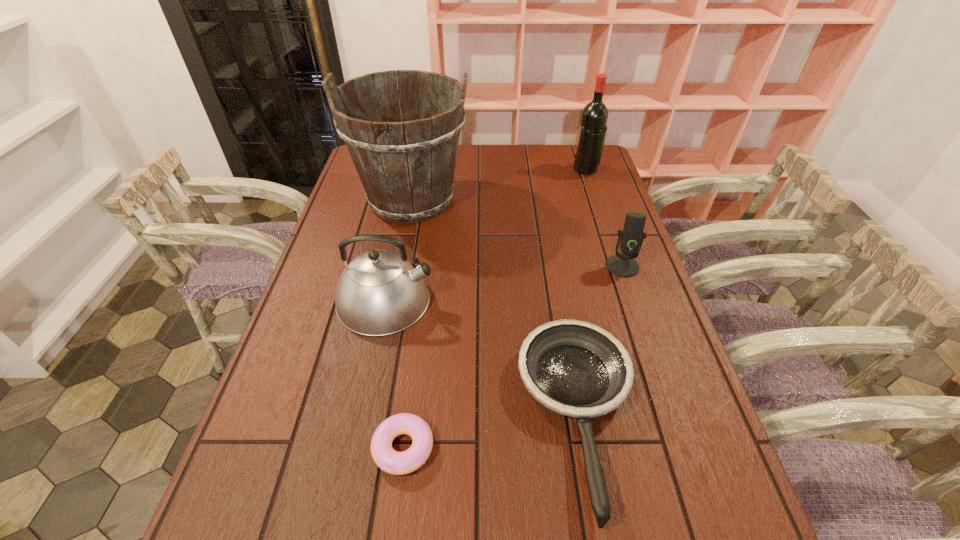
You are a GUI agent. You are given a task and a screenshot of the screen. Output one action in this format:
    pyautogui.click(x=<x>, y=<y>)
    Task: Click on the vacant region located 0.070m on the left of the microphone
    The height and width of the screenshot is (540, 960).
    Given the screenshot: What is the action you would take?
    coord(581,266)

The height and width of the screenshot is (540, 960). Find the location of `blank space located on the back of the shortest object`. blank space located on the back of the shortest object is located at coordinates (414, 366).

What are the coordinates of `bucket that is at the far edge` in the screenshot? It's located at (406, 166).

You are a GUI agent. You are given a task and a screenshot of the screen. Output one action in this format:
    pyautogui.click(x=<x>, y=<y>)
    Task: Click on the wine bottle that is at the far edge
    The width and height of the screenshot is (960, 540).
    Given the screenshot: What is the action you would take?
    pyautogui.click(x=594, y=116)

The height and width of the screenshot is (540, 960). Find the location of `bucket that is at the left edge`. bucket that is at the left edge is located at coordinates (406, 166).

Where is `kettle at the left edge`? kettle at the left edge is located at coordinates (380, 292).

Where is `wine bottle that is at the right edge`? The image size is (960, 540). wine bottle that is at the right edge is located at coordinates (594, 116).

The width and height of the screenshot is (960, 540). I want to click on microphone present at the right edge, so click(x=624, y=265).

Find the location of a particular element. The height and width of the screenshot is (540, 960). frying pan located in the right edge section of the desktop is located at coordinates (575, 368).

Where is `object at the far left corner`? The height and width of the screenshot is (540, 960). object at the far left corner is located at coordinates (406, 166).